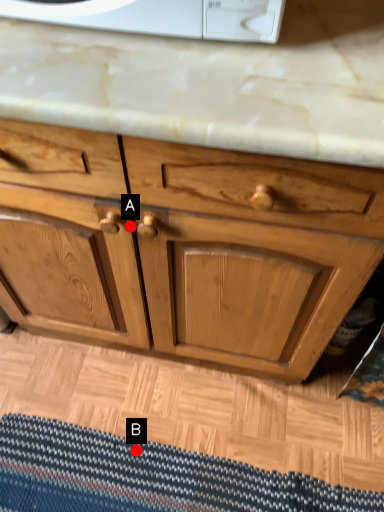
Question: Two points are circled on the image, labeled by A and B beside each circle. Among these points, which one is farthest from the camera?

Choices:
 (A) A is further
 (B) B is further

Answer: (B)